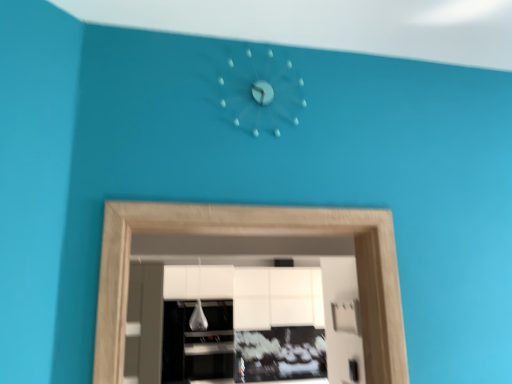
This screenshot has width=512, height=384. In order to click on white plastic clock at upper center in this screenshot , I will do `click(257, 88)`.

What do you see at coordinates (257, 88) in the screenshot?
I see `white plastic clock at upper center` at bounding box center [257, 88].

I want to click on white plastic clock at upper center, so click(257, 88).